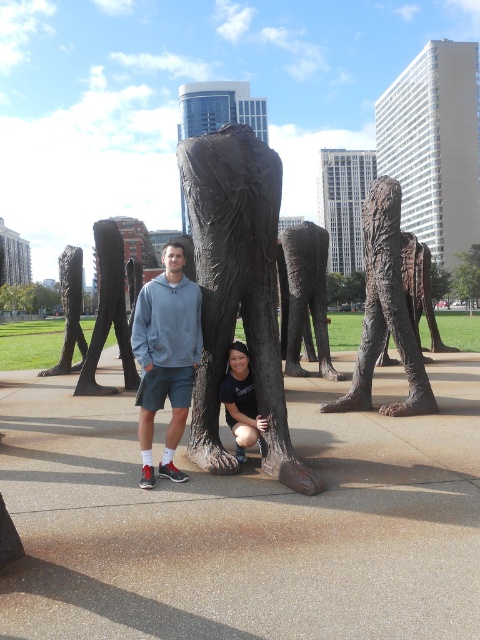
Who is higher up, bronze/sculpture at center or bronze statue leg at center?

bronze/sculpture at center

Where is `bronze/sculpture at center`? This screenshot has width=480, height=640. bronze/sculpture at center is located at coordinates (385, 310).

Between bronze textured leg at center and matte black shirt at center, which one is positioned higher?

bronze textured leg at center

The width and height of the screenshot is (480, 640). I want to click on bronze textured leg at center, so click(108, 312).

What are the coordinates of `bronze textured leg at center` in the screenshot? It's located at (108, 312).

Where is `bronze/sculpture at center`? bronze/sculpture at center is located at coordinates (385, 310).

Locate an element on the screen. This screenshot has width=480, height=640. bronze/sculpture at center is located at coordinates (385, 310).